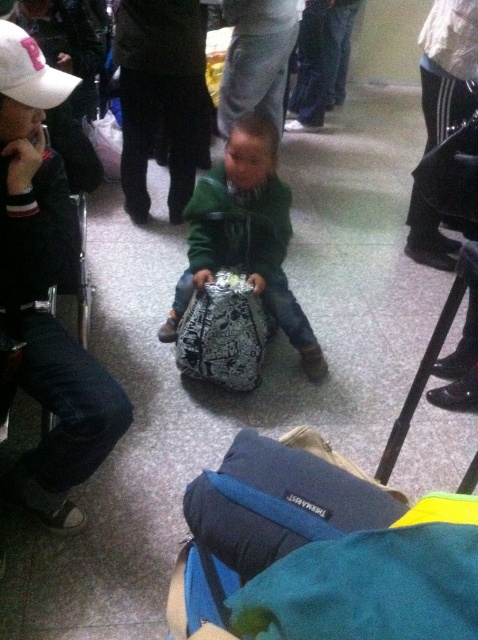
Can you confirm if green matte jacket at center is shorter than white matte baseball cap at upper left?

No.

Between point (248, 128) and point (33, 97), which one is positioned behind?

Point (248, 128)

Where is `green matte jacket at center`? green matte jacket at center is located at coordinates (246, 236).

Which is below, metallic silver bag at center or white matte baseball cap at upper left?

metallic silver bag at center is below.

I want to click on metallic silver bag at center, so click(x=224, y=333).

Based on the photo, who is more distant from viewer, (209,182) or (213,337)?

Point (209,182)

Is green matte jacket at center bigger than metallic silver bag at center?

Yes.

Does point (198, 268) lie behind point (235, 269)?

Yes, it is behind point (235, 269).

Locate an element on the screen. The height and width of the screenshot is (640, 478). green matte jacket at center is located at coordinates 246,236.